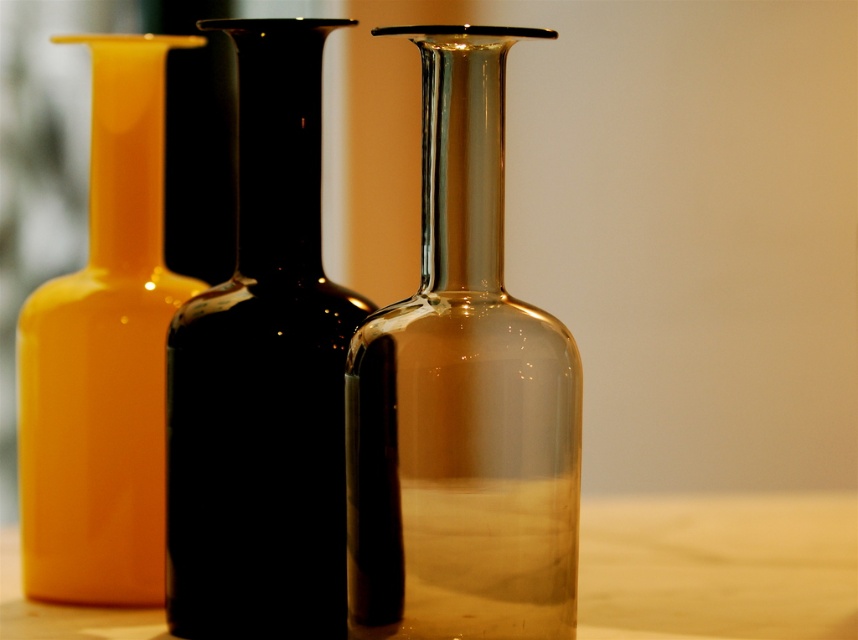
Question: Which point appears closest to the camera in this image?

Choices:
 (A) (142, 182)
 (B) (403, 627)
 (C) (765, 570)

Answer: (B)

Question: Can you confirm if black glass bottle at center is smaller than wooden table at center?

Choices:
 (A) yes
 (B) no

Answer: (A)

Question: Which object is farther from the camera taking this photo?

Choices:
 (A) matte yellow vase at left
 (B) transparent glass bottle at center
 (C) wooden table at center
 (D) black glass bottle at center

Answer: (A)

Question: Which object is the closest to the wooden table at center?

Choices:
 (A) matte yellow vase at left
 (B) black glass bottle at center
 (C) transparent glass bottle at center

Answer: (A)

Question: From the image, what is the correct spatial relationship of black glass bottle at center in relation to wooden table at center?

Choices:
 (A) above
 (B) below

Answer: (A)

Question: Does black glass bottle at center appear under wooden table at center?

Choices:
 (A) yes
 (B) no

Answer: (B)